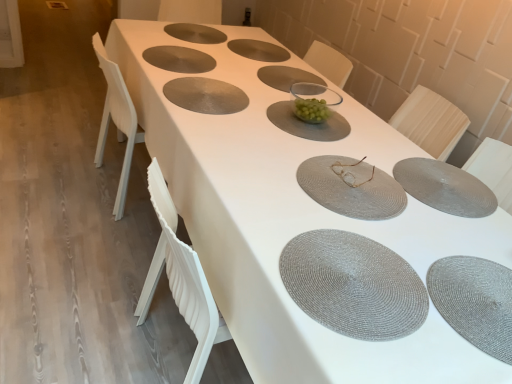
Locate an element on the screen. This screenshot has width=512, height=384. free space to the left of green glass bowl at center, arranged as the 5th tableware when ordered from the bottom is located at coordinates (x=230, y=103).